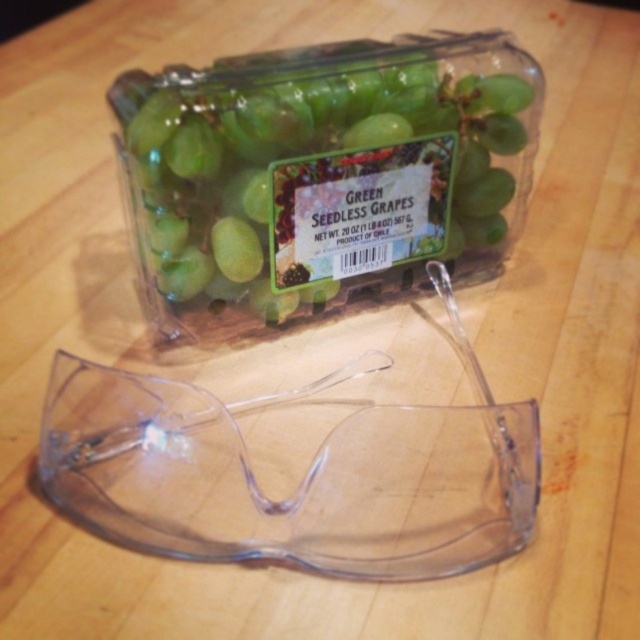
Question: Which point is closer to the camera?

Choices:
 (A) transparent plastic goggles at center
 (B) green matte seedless grapes at upper center

Answer: (A)

Question: Can you confirm if green matte seedless grapes at upper center is thinner than transparent plastic goggles at center?

Choices:
 (A) yes
 (B) no

Answer: (A)

Question: Which object is closer to the camera taking this photo?

Choices:
 (A) green matte seedless grapes at upper center
 (B) transparent plastic goggles at center

Answer: (B)

Question: Does green matte seedless grapes at upper center appear under transparent plastic goggles at center?

Choices:
 (A) no
 (B) yes

Answer: (A)

Question: Observing the image, what is the correct spatial positioning of green matte seedless grapes at upper center in reference to transparent plastic goggles at center?

Choices:
 (A) below
 (B) above

Answer: (B)